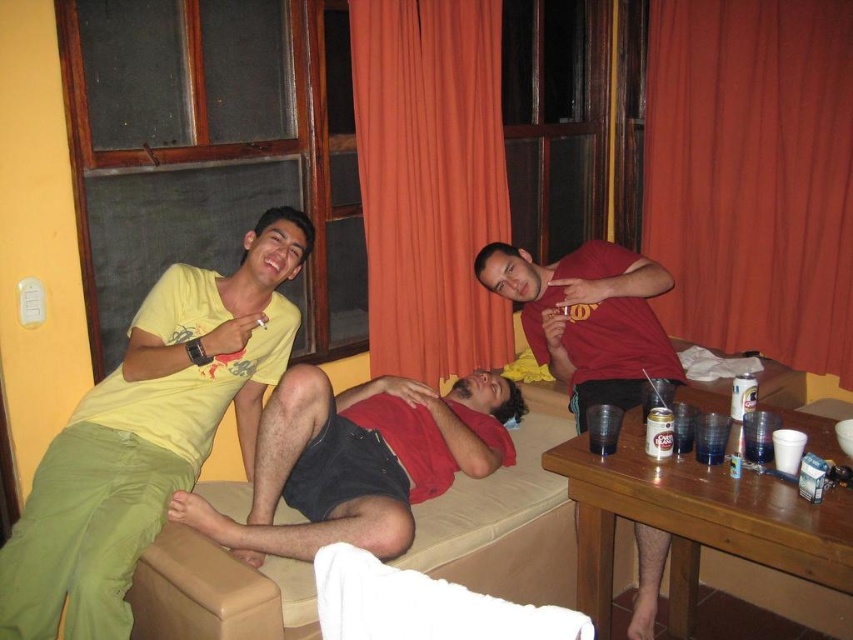
Does matte red shirt at center have a larger size compared to beige fabric couch at center?

Correct, matte red shirt at center is larger in size than beige fabric couch at center.

Where is `matte red shirt at center`? This screenshot has width=853, height=640. matte red shirt at center is located at coordinates (341, 472).

Between orange fabric curtain at right and matte red shirt at center, which one has less height?

With less height is matte red shirt at center.

Who is positioned more to the left, orange fabric curtain at right or matte red shirt at center?

Positioned to the left is matte red shirt at center.

Find the location of a particular element. This screenshot has height=640, width=853. orange fabric curtain at right is located at coordinates (753, 176).

Can you confirm if orange fabric curtain at right is wider than matte red t-shirt at center?

Indeed, orange fabric curtain at right has a greater width compared to matte red t-shirt at center.

Which is in front, point (776, 1) or point (634, 282)?

Point (634, 282) is more forward.

At what (x,y) coordinates should I click in order to perform the action: click on orange fabric curtain at right. Please return your answer as a coordinate pair (x, y). This screenshot has height=640, width=853. Looking at the image, I should click on (753, 176).